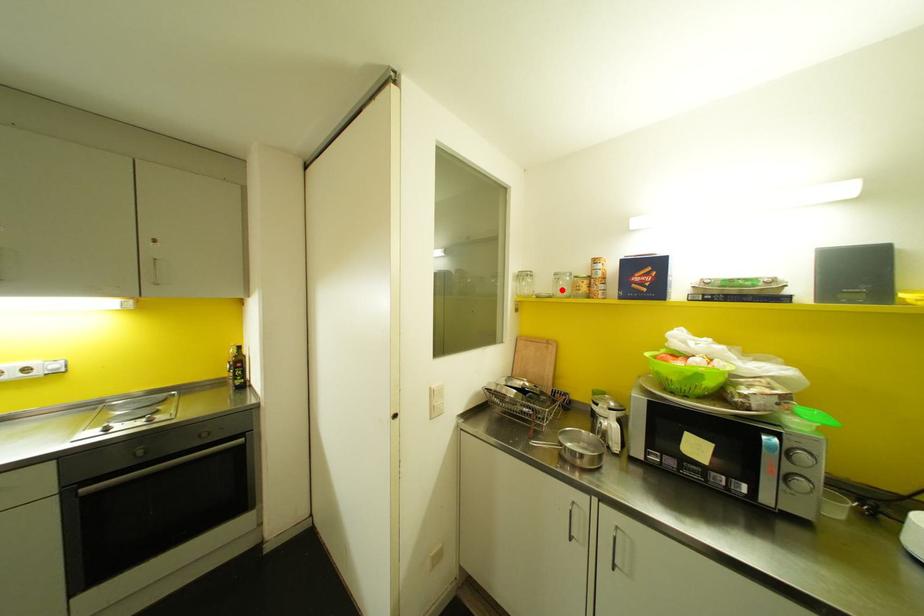
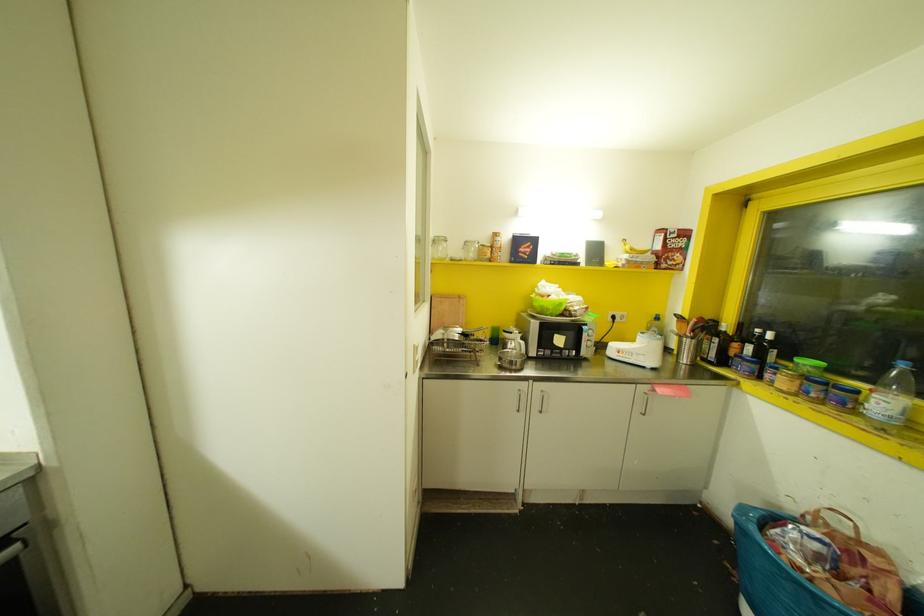
The point at the highlighted location is marked in the first image. Where is the corresponding point in the second image?

(470, 254)